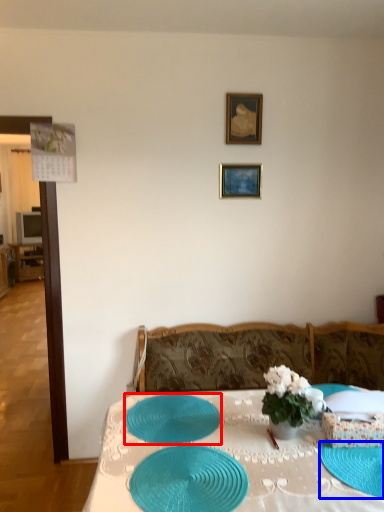
Question: Among these objects, which one is farthest to the camera, tableware (highlighted by a red box) or glass plate (highlighted by a blue box)?

Choices:
 (A) tableware
 (B) glass plate

Answer: (A)